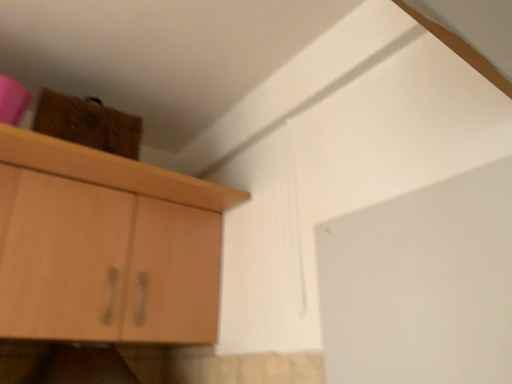
The width and height of the screenshot is (512, 384). What do you see at coordinates (88, 124) in the screenshot?
I see `wooden chest at upper left` at bounding box center [88, 124].

This screenshot has width=512, height=384. Identify the location of wooden chest at upper left. (88, 124).

Find the location of `wooden chest at upper left`. wooden chest at upper left is located at coordinates (88, 124).